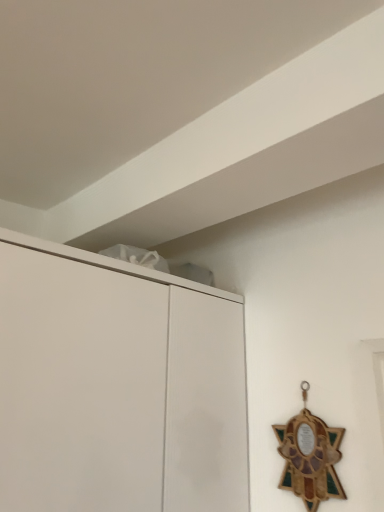
Image resolution: width=384 pixels, height=512 pixels. In order to click on wooden stained glass star at upper right in this screenshot , I will do `click(310, 458)`.

The image size is (384, 512). What do you see at coordinates (310, 458) in the screenshot? I see `wooden stained glass star at upper right` at bounding box center [310, 458].

Measure the distance between wooden stained glass star at upper right and camera.

The depth of wooden stained glass star at upper right is 3.42 feet.

The width and height of the screenshot is (384, 512). I want to click on wooden stained glass star at upper right, so click(310, 458).